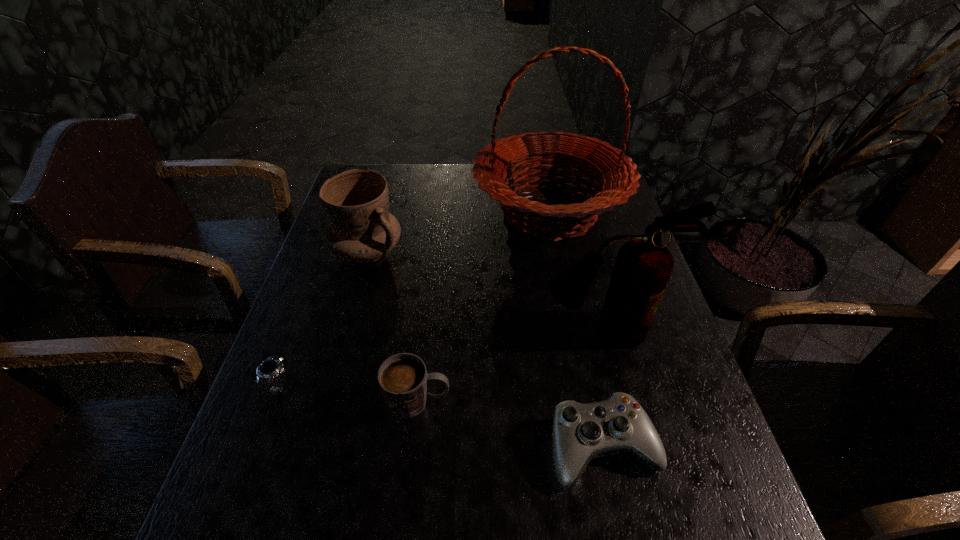
This screenshot has height=540, width=960. In order to click on the tallest object in this screenshot , I will do `click(616, 174)`.

Where is `the third farthest object`? This screenshot has width=960, height=540. the third farthest object is located at coordinates (x=643, y=266).

The image size is (960, 540). What are the coordinates of `fire extinguisher` in the screenshot? It's located at (643, 266).

The height and width of the screenshot is (540, 960). Identify the location of pottery. (356, 202).

You are a GUI agent. You are given a task and a screenshot of the screen. Output one action in this format:
    pyautogui.click(x=<x>, y=<y>)
    Task: Click on the fourth tallest object
    
    Given the screenshot: What is the action you would take?
    pyautogui.click(x=403, y=379)

Locate an element on the screen. mug is located at coordinates pos(403,379).

You are a GUI agent. You are given a task and a screenshot of the screen. Output one action in this format:
    pyautogui.click(x=<x>, y=<y>)
    Task: Click on the second shortest object
    
    Given the screenshot: What is the action you would take?
    (581, 432)

At what (x,y) coordinates should I click in order to perform the action: click on the shortest object. Please return your answer as a coordinate pair (x, y). This screenshot has width=960, height=540. Looking at the image, I should click on (275, 366).

At what (x,y) coordinates should I click in order to perform the action: click on vacant space located 0.050m on the back of the basket. Please return your answer as a coordinate pair (x, y). Looking at the image, I should click on (540, 165).

You are a GUI agent. You are given a task and a screenshot of the screen. Output one action in this format:
    pyautogui.click(x=<x>, y=<y>)
    Task: Click on the vacant space located 0.250m at the nozzle of the fifth shortest object
    
    Given the screenshot: What is the action you would take?
    pyautogui.click(x=636, y=456)